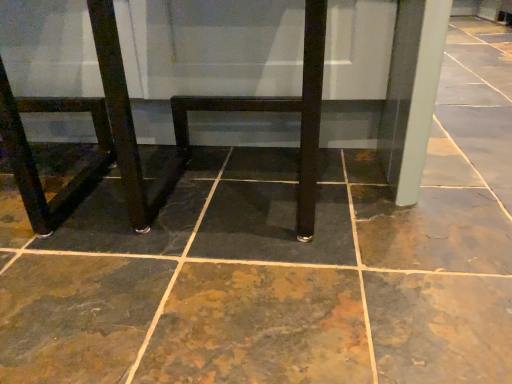
Question: Would you say matte black table at center is to the left or to the right of brown stone floor at center in the picture?

Choices:
 (A) right
 (B) left

Answer: (B)

Question: Is matte black table at center spatially inside brown stone floor at center, or outside of it?

Choices:
 (A) outside
 (B) inside

Answer: (A)

Question: Estimate the real-world distances between objects in this image. Which object is closer to the brown stone floor at center?

Choices:
 (A) matte black table at center
 (B) matte black chair at lower left

Answer: (A)

Question: Based on their relative distances, which object is farther from the matte black table at center?

Choices:
 (A) brown stone floor at center
 (B) matte black chair at lower left

Answer: (A)